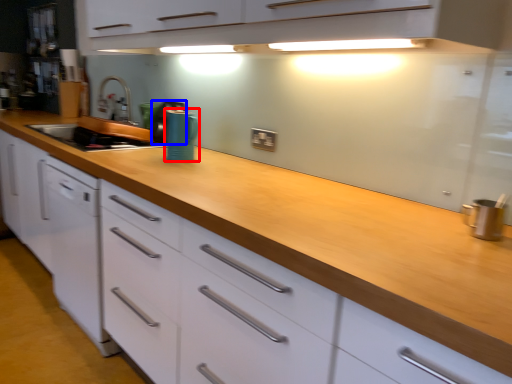
Question: Which of the following is the farthest to the observer, appliance (highlighted by a red box) or appliance (highlighted by a blue box)?

Choices:
 (A) appliance
 (B) appliance

Answer: (B)